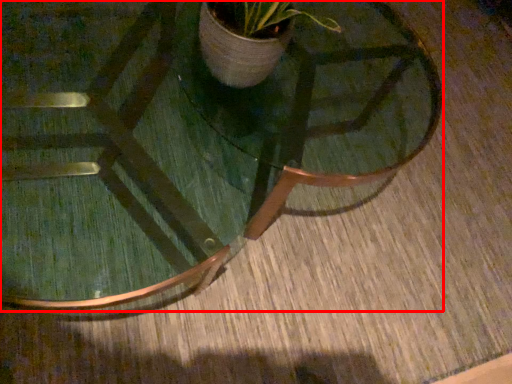
Question: Considering the relative positions of coffee table (annotated by the red box) and round table in the image provided, where is coffee table (annotated by the red box) located with respect to the staircase?

Choices:
 (A) left
 (B) right

Answer: (A)